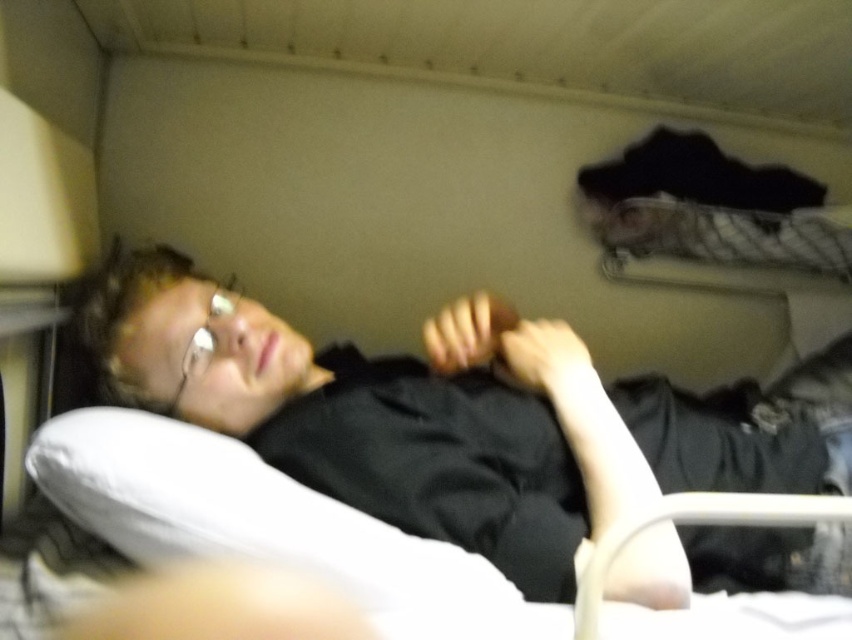
Question: Can you confirm if black matte shirt at center is thinner than white soft pillow at lower left?

Choices:
 (A) no
 (B) yes

Answer: (A)

Question: Where is black matte shirt at center located in relation to white soft pillow at lower left in the image?

Choices:
 (A) right
 (B) left

Answer: (A)

Question: Which point is closer to the camera taking this photo?

Choices:
 (A) (792, 547)
 (B) (360, 531)

Answer: (B)

Question: Which object appears farthest from the camera in this image?

Choices:
 (A) black matte shirt at center
 (B) white soft pillow at lower left

Answer: (A)

Question: Observing the image, what is the correct spatial positioning of black matte shirt at center in reference to white soft pillow at lower left?

Choices:
 (A) above
 (B) below

Answer: (A)

Question: Which point is farther to the camera?

Choices:
 (A) white soft pillow at lower left
 (B) black matte shirt at center

Answer: (B)